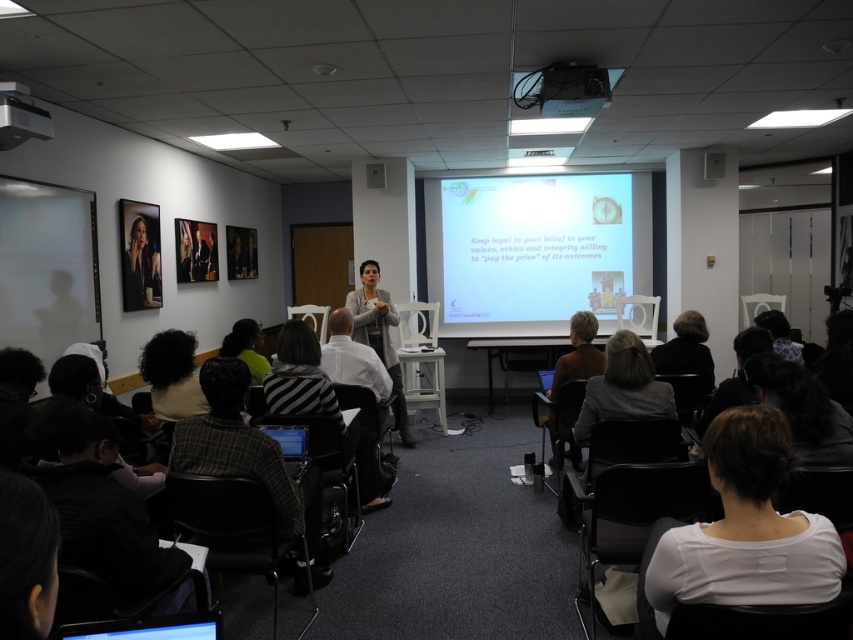
You are sitting in the front row of the seminar and notice two points marked in the room. One is at coordinate point (434, 268) and the other at point (3, 116). Which point is closer to your position?

Point (3, 116) is closer to your position because it is nearer to the camera compared to point (434, 268), which is further away.

You are an attendee at the front of the room and want to present a slide. The screen is at point (x=450, y=276). Can you reach the screen to adjust it?

The white matte projection screen at upper center is located at point (x=450, y=276). Since you are at the front of the room, you can reach the screen to adjust it.

You are organizing a photo shoot in this room and need to place two mannequins wearing the white matte shirt at lower right and the light gray sweater at center. Based on their sizes, which mannequin should be placed closer to the camera to ensure both appear proportionate in the final image?

The white matte shirt at lower right is narrower than the light gray sweater at center. To make them appear proportionate, the white matte shirt at lower right should be placed closer to the camera since it is smaller in width, compensating for its smaller size by positioning it nearer to maintain visual balance.